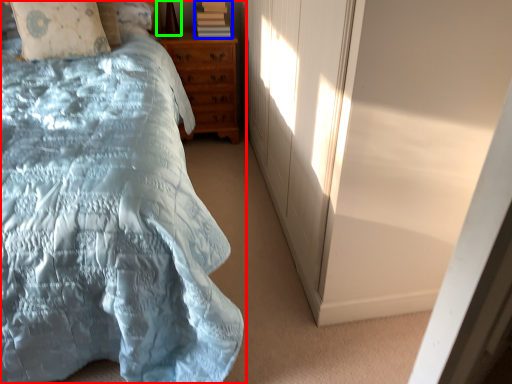
Question: Which object is positioned farthest from bed (highlighted by a red box)? Select from book (highlighted by a blue box) and table lamp (highlighted by a green box).

Choices:
 (A) book
 (B) table lamp

Answer: (B)